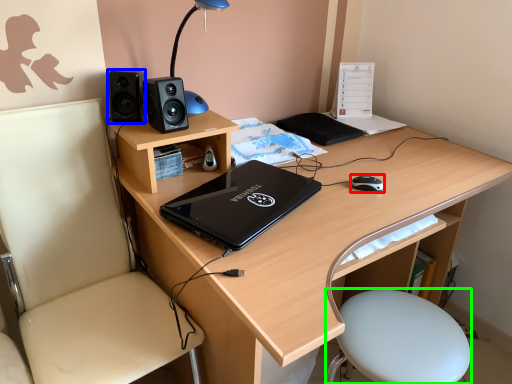
Question: Based on their relative distances, which object is farther from mouse (highlighted by a red box)? Choose from speaker (highlighted by a blue box) and bar stool (highlighted by a green box).

Choices:
 (A) speaker
 (B) bar stool

Answer: (A)